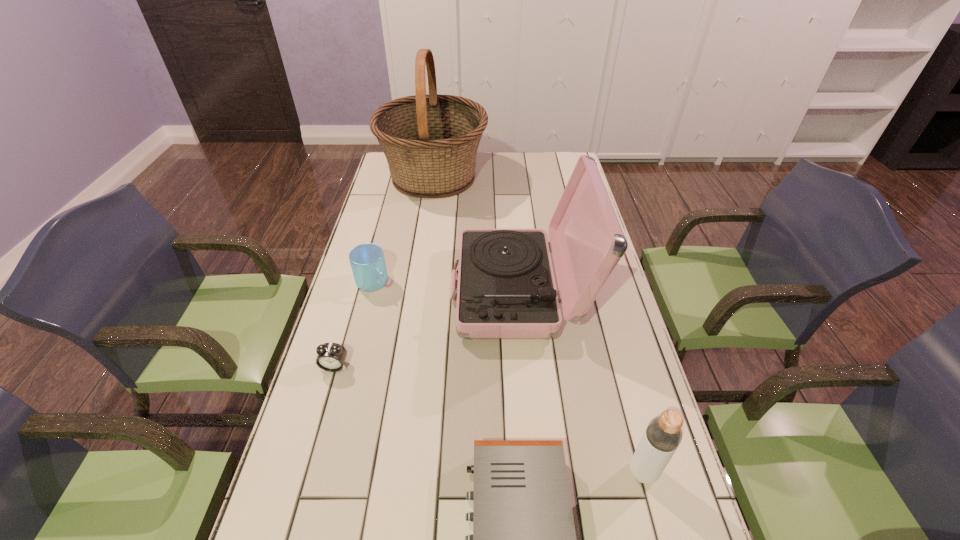
The height and width of the screenshot is (540, 960). I want to click on free space located 0.380m on the back of the bottle, so [x=605, y=330].

At what (x,y) coordinates should I click in order to perform the action: click on free space located 0.070m on the front of the fourth tallest object. Please return your answer as a coordinate pair (x, y). The width and height of the screenshot is (960, 540). Looking at the image, I should click on (366, 313).

The width and height of the screenshot is (960, 540). I want to click on vacant space situated on the front side of the fourth farthest object, so point(315,433).

I want to click on object present at the far edge, so click(430, 141).

Locate an element on the screen. basket located in the left edge section of the desktop is located at coordinates (430, 141).

The height and width of the screenshot is (540, 960). Find the location of `mug situated at the left edge`. mug situated at the left edge is located at coordinates [x=367, y=261].

Where is `alarm clock situated at the left edge`? This screenshot has width=960, height=540. alarm clock situated at the left edge is located at coordinates (331, 356).

You are a GUI agent. You are given a task and a screenshot of the screen. Output one action in this format:
    pyautogui.click(x=<x>, y=<y>)
    Task: Click on the record player that is at the right edge
    
    Given the screenshot: What is the action you would take?
    pyautogui.click(x=506, y=289)

Identify the location of bottle located in the right edge section of the desktop. (663, 435).

What are the coordinates of `object that is at the far left corner` in the screenshot? It's located at (430, 141).